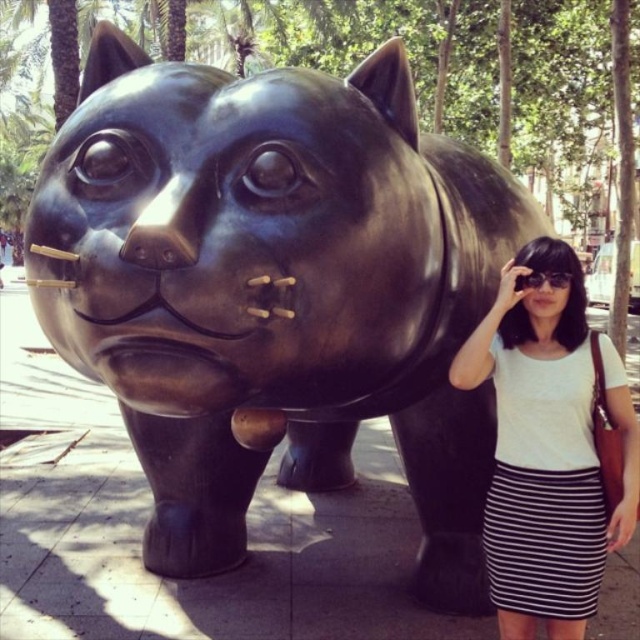
Does white striped skirt at lower right have a greater height compared to black plastic goggles at upper center?

Correct, white striped skirt at lower right is much taller as black plastic goggles at upper center.

Does point (634, 474) lie in front of point (540, 284)?

Yes, point (634, 474) is closer to viewer.

Does point (576, 552) come farther from viewer compared to point (554, 280)?

No, it is in front of (554, 280).

This screenshot has height=640, width=640. In order to click on white striped skirt at lower right in this screenshot , I will do `click(548, 449)`.